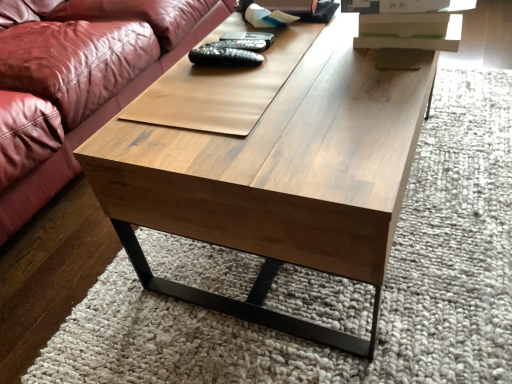
Locate an element on the screen. The image size is (512, 384). free space that is to the left of black matte remote at center, positioned as the first remote in bottom-to-top order is located at coordinates (174, 86).